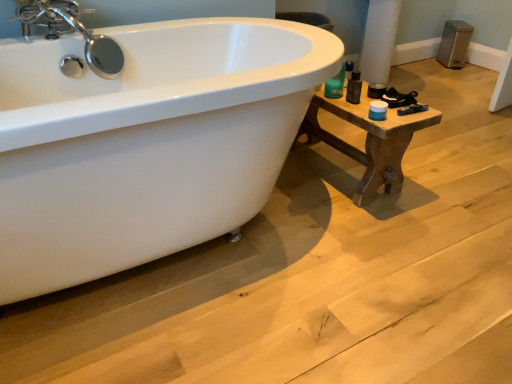
You are a GUI agent. You are given a task and a screenshot of the screen. Output one action in this format:
    pyautogui.click(x=<x>, y=<y>)
    Task: Click on the free space in front of matte black container at right
    
    Given the screenshot: What is the action you would take?
    pyautogui.click(x=387, y=100)